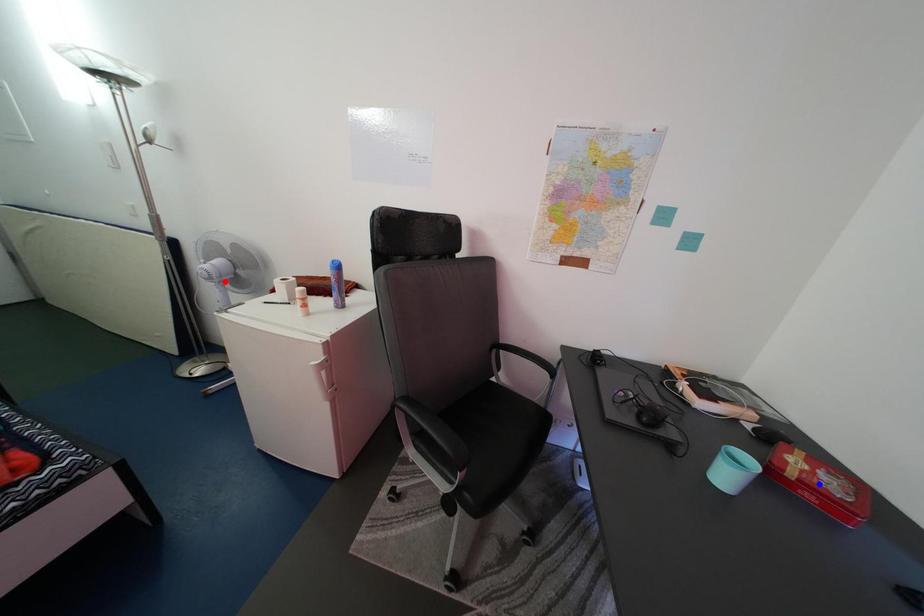
Question: Which of the two points in the image is closer to the camera?

Choices:
 (A) Blue point is closer.
 (B) Red point is closer.

Answer: (A)